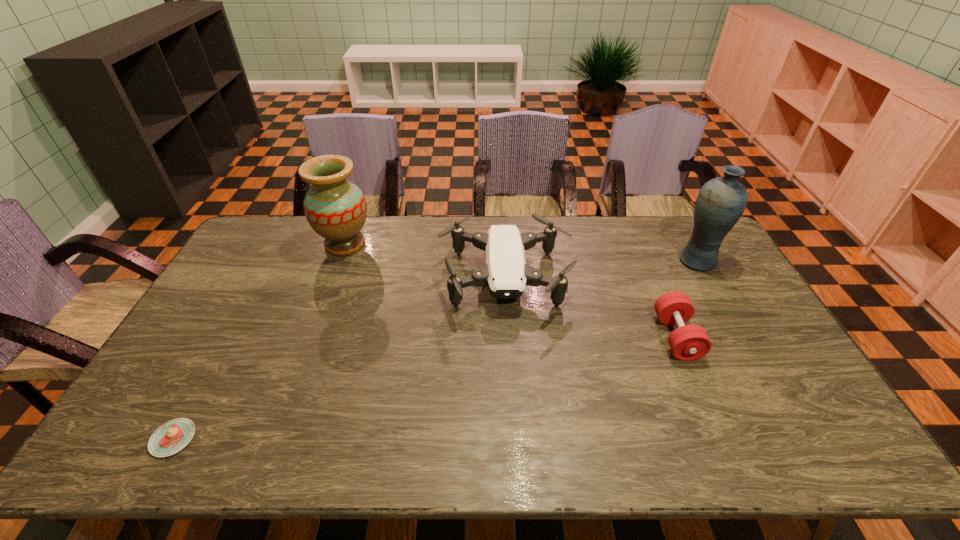
At what (x,y) coordinates should I click in order to perform the action: click on vacant space at the near edge of the desktop. Please return your answer as a coordinate pair (x, y). Looking at the image, I should click on click(691, 437).

This screenshot has height=540, width=960. In order to click on free spot at the left edge of the desktop in this screenshot , I will do `click(177, 353)`.

You are a GUI agent. You are given a task and a screenshot of the screen. Output one action in this format:
    pyautogui.click(x=<x>, y=<y>)
    Task: Click on the free space at the right edge of the desktop
    The width and height of the screenshot is (960, 540).
    Given the screenshot: What is the action you would take?
    pyautogui.click(x=747, y=291)

This screenshot has width=960, height=540. I want to click on vacant space at the near left corner, so click(142, 427).

Locate an element on the screen. free space between the nearest object and the left vase is located at coordinates (259, 341).

Where is `free space that is in between the leftmost object and the right vase`? The width and height of the screenshot is (960, 540). free space that is in between the leftmost object and the right vase is located at coordinates (435, 349).

I want to click on vacant area that lies between the drone and the rightmost object, so click(601, 271).

Identify the location of empty space between the left vase and the pastry. (259, 341).

Where is `free spot between the fourth object from right to left and the leftmost object`? Image resolution: width=960 pixels, height=540 pixels. free spot between the fourth object from right to left and the leftmost object is located at coordinates (259, 341).

At what (x,y) coordinates should I click in order to perform the action: click on vacant space in between the third shortest object and the left vase. Please return your answer as a coordinate pair (x, y). Looking at the image, I should click on (425, 262).